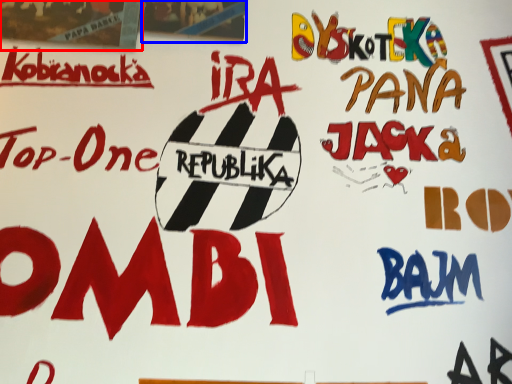
Question: Which object appears farthest to the camera in this image, poster (highlighted by a red box) or poster (highlighted by a blue box)?

Choices:
 (A) poster
 (B) poster

Answer: (B)